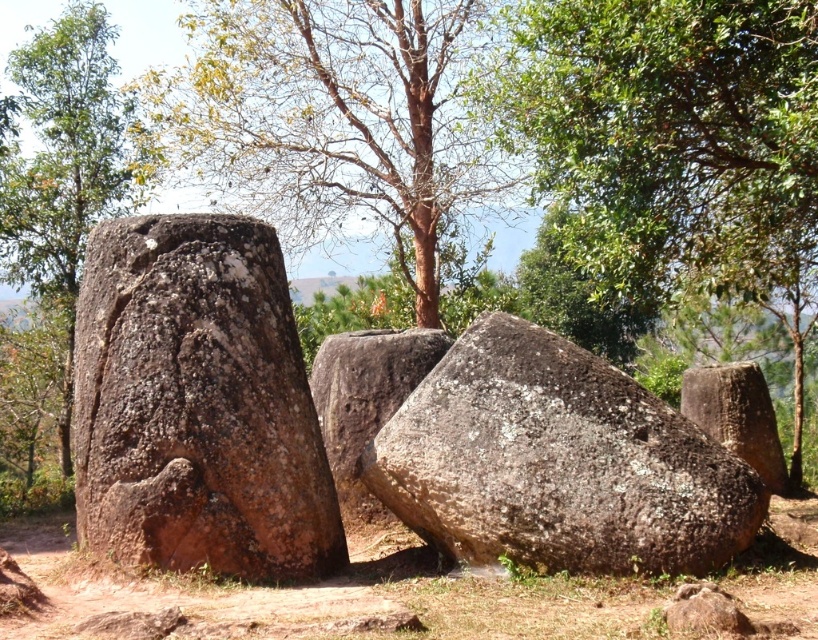
You are standing at the origin point of the coordinate system. Which direction should you move to reach the brown rough stone at left?

The brown rough stone at left is located at coordinate point (196, 404), so you should move towards the right and forward to reach it.

From the picture: You are an archaeologist examining the outdoor site. You need to determine which object is taller between the green rough bark tree at left and the brown rough boulder at right. Based on the scene, can you identify which one is taller?

The green rough bark tree at left is taller than the brown rough boulder at right.

You are standing at the center of the archaeological site. You need to locate the green rough bark tree at left. Which direction should you face to see it?

The green rough bark tree at left is located at point (65, 168), which is to the left of your current position. You should face left to see it.